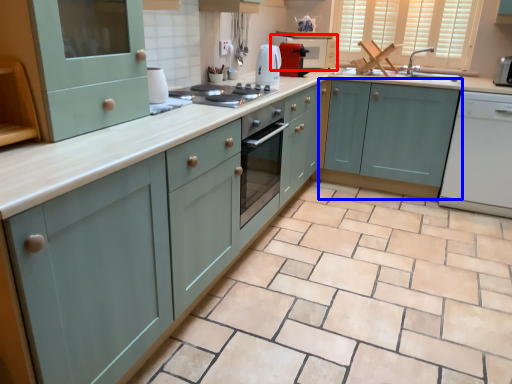
Question: Among these objects, which one is farthest to the camera, microwave (highlighted by a red box) or cabinetry (highlighted by a blue box)?

Choices:
 (A) microwave
 (B) cabinetry

Answer: (A)